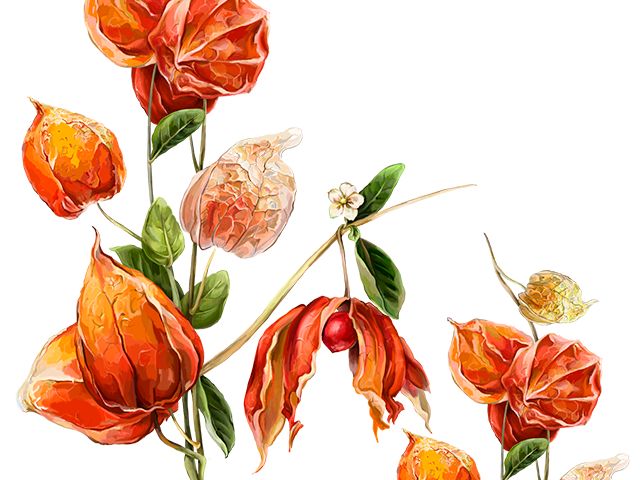
This screenshot has width=640, height=480. What are the coordinates of `smaller chinese lantern bulbs` in the screenshot? It's located at (547, 299), (589, 468).